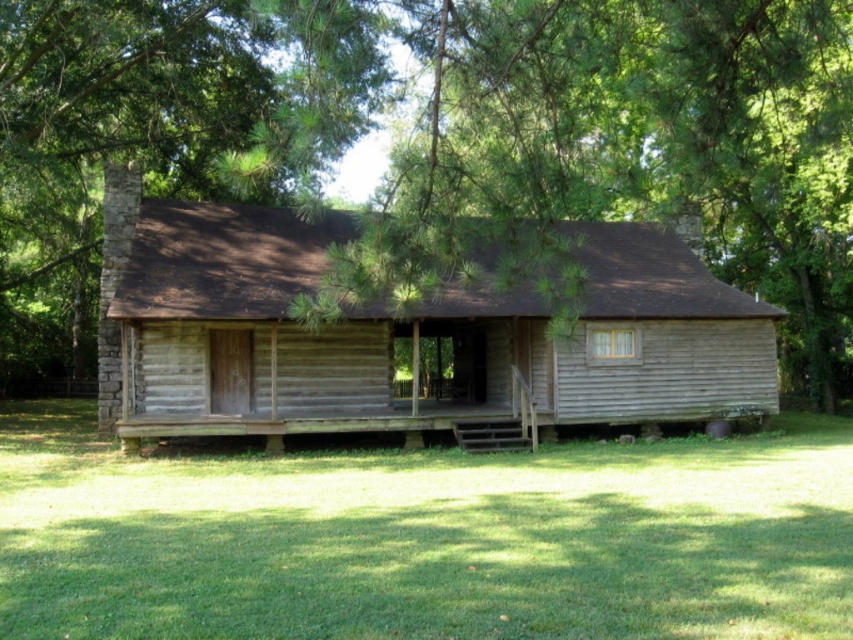
Question: Which point is farther to the camera?

Choices:
 (A) weathered wood cabin at center
 (B) green leafy tree at center

Answer: (A)

Question: Which point is closer to the camera?

Choices:
 (A) weathered wood cabin at center
 (B) green leafy tree at center

Answer: (B)

Question: Is green leafy tree at center smaller than weathered wood cabin at center?

Choices:
 (A) no
 (B) yes

Answer: (A)

Question: Does green leafy tree at center have a greater width compared to weathered wood cabin at center?

Choices:
 (A) no
 (B) yes

Answer: (B)

Question: Is green leafy tree at center thinner than weathered wood cabin at center?

Choices:
 (A) no
 (B) yes

Answer: (A)